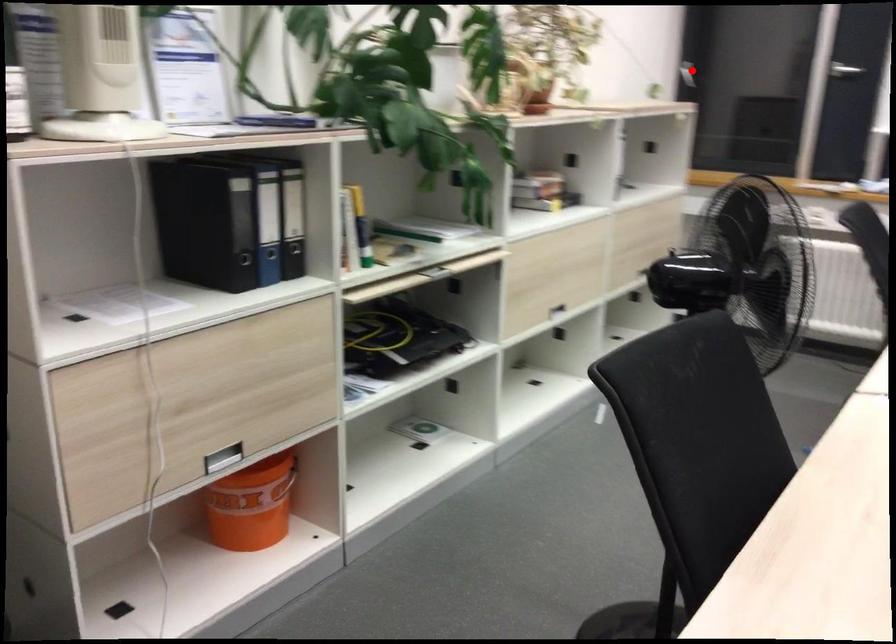
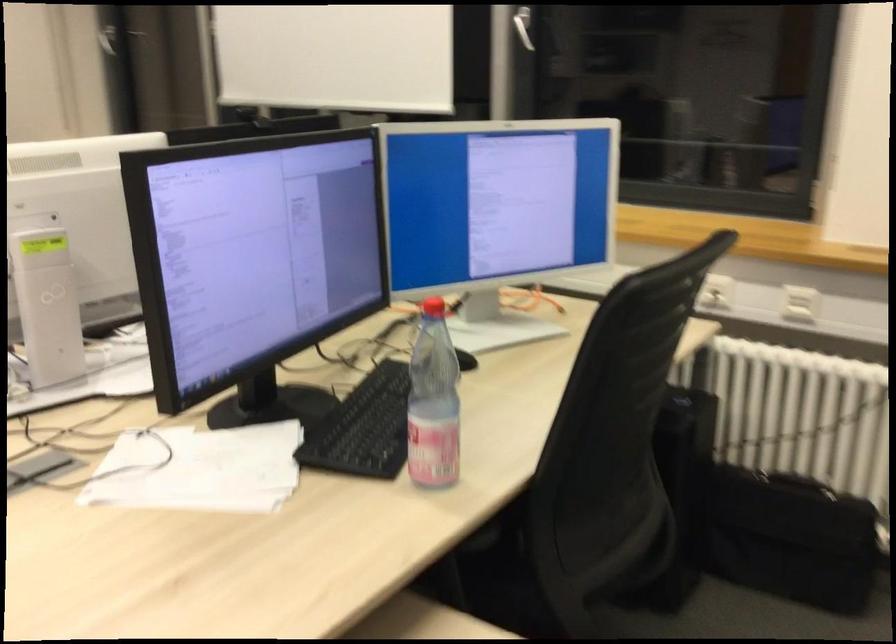
Question: I am providing you with two images of the same scene from different viewpoints. A red point is shown in image1. For the corresponding object point in image2, is it positioned nearer or farther from the camera?

Choices:
 (A) Nearer
 (B) Farther

Answer: (A)